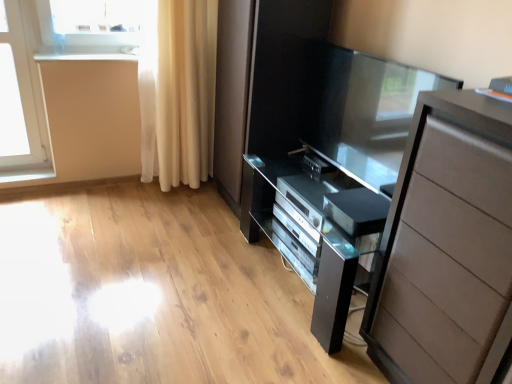
Where is `vacant space that is to the left of light beige sheer curtain at left`? The height and width of the screenshot is (384, 512). vacant space that is to the left of light beige sheer curtain at left is located at coordinates (112, 194).